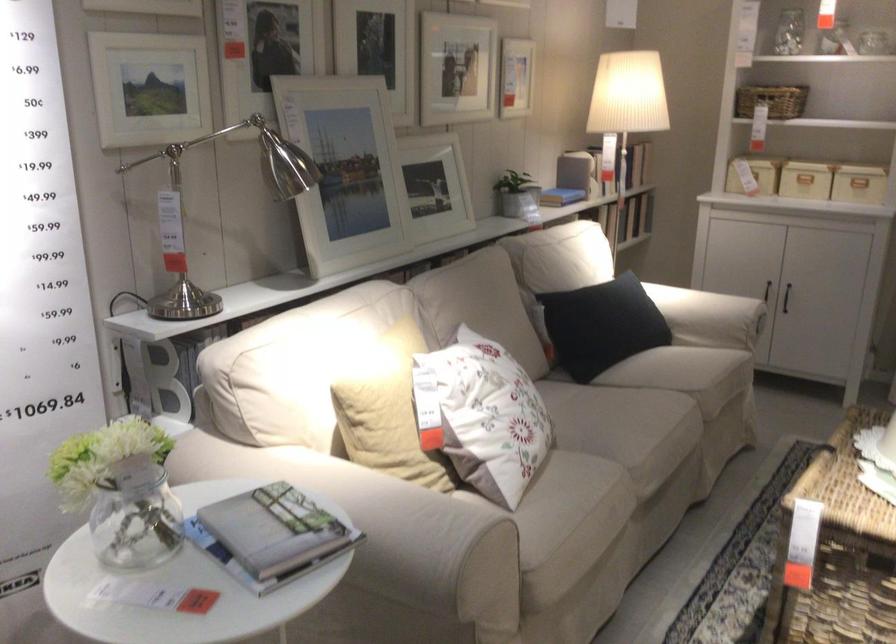
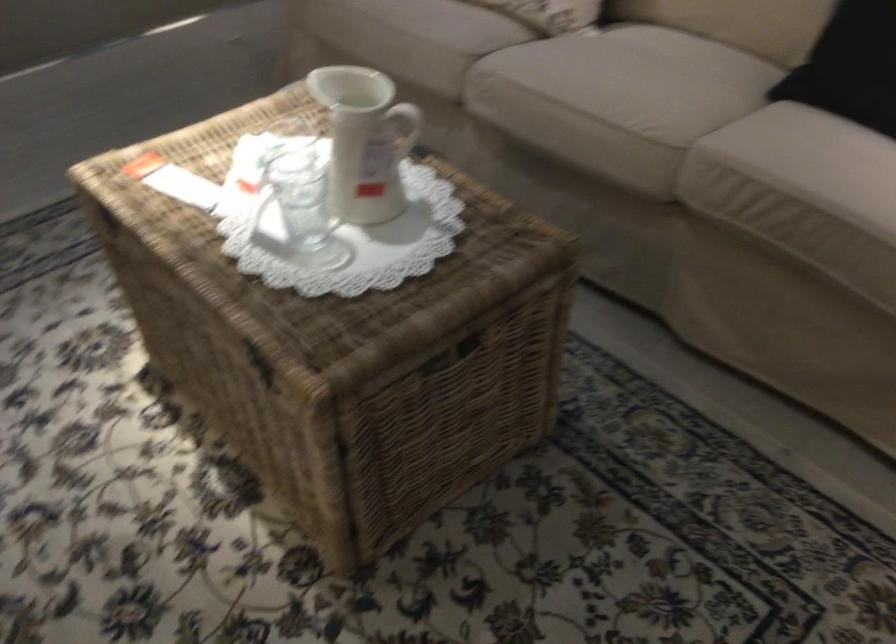
The point at [658,413] is marked in the first image. Where is the corresponding point in the second image?

(617, 93)